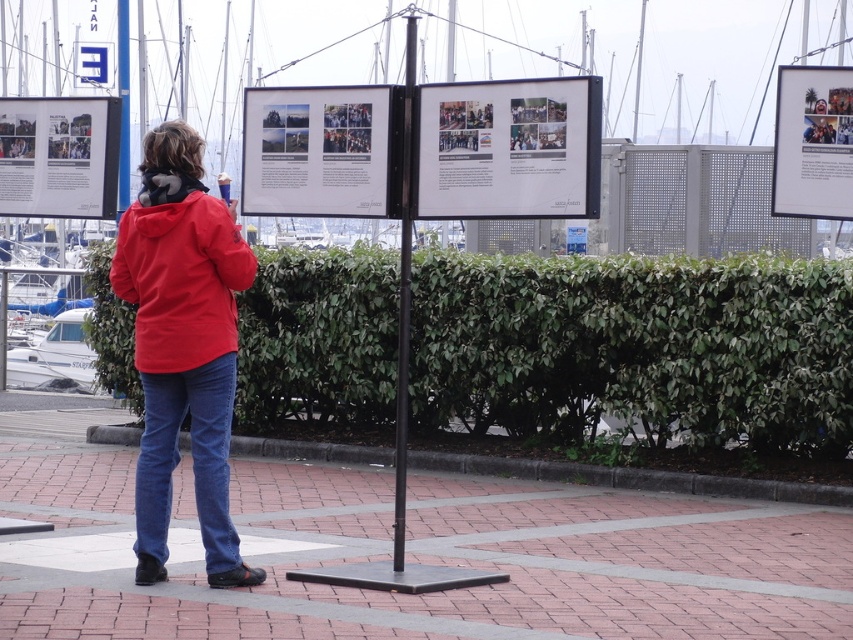
Is matte red jacket at center below matte white poster at upper right?

Yes, matte red jacket at center is below matte white poster at upper right.

Image resolution: width=853 pixels, height=640 pixels. I want to click on matte red jacket at center, so click(x=180, y=273).

You are a GUI agent. You are given a task and a screenshot of the screen. Output one action in this format:
    pyautogui.click(x=<x>, y=<y>)
    Task: Click on the matte red jacket at center
    The height and width of the screenshot is (640, 853).
    Given the screenshot: What is the action you would take?
    pyautogui.click(x=180, y=273)

The image size is (853, 640). What do you see at coordinates (180, 273) in the screenshot?
I see `matte red jacket at center` at bounding box center [180, 273].

From the picture: Which is more to the right, matte red jacket at center or matte white poster at left?

matte red jacket at center

Between point (170, 240) and point (16, 113), which one is positioned in front?

Point (170, 240) is more forward.

Locate an element on the screen. Image resolution: width=853 pixels, height=640 pixels. matte red jacket at center is located at coordinates (180, 273).

Which of these two, matte paper poster at center or matte white poster at left, stands shorter?

With less height is matte paper poster at center.

This screenshot has width=853, height=640. I want to click on matte paper poster at center, so click(321, 150).

Which is in front, point (341, 214) or point (41, 208)?

Positioned in front is point (341, 214).

Find the location of `matte paper poster at center`. matte paper poster at center is located at coordinates click(x=321, y=150).